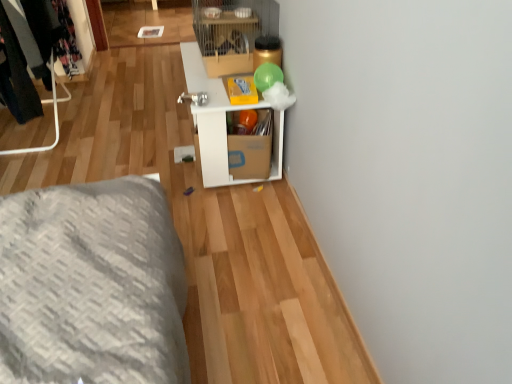
Question: From their relative heights in the image, would you say white cardboard shelf at center is taller or shorter than metal clothing rack at left?

Choices:
 (A) short
 (B) tall

Answer: (A)

Question: Is white cardboard shelf at center spatially inside metal clothing rack at left, or outside of it?

Choices:
 (A) outside
 (B) inside

Answer: (A)

Question: Considering the positions of white cardboard shelf at center and metal clothing rack at left in the image, is white cardboard shelf at center wider or thinner than metal clothing rack at left?

Choices:
 (A) thin
 (B) wide

Answer: (B)

Question: From the image's perspective, relative to white cardboard shelf at center, is metal clothing rack at left above or below?

Choices:
 (A) below
 (B) above

Answer: (B)

Question: From a real-world perspective, relative to white cardboard shelf at center, is metal clothing rack at left vertically above or below?

Choices:
 (A) below
 (B) above

Answer: (B)

Question: In the image, is metal clothing rack at left positioned in front of or behind white cardboard shelf at center?

Choices:
 (A) front
 (B) behind

Answer: (B)

Question: In terms of size, does metal clothing rack at left appear bigger or smaller than white cardboard shelf at center?

Choices:
 (A) big
 (B) small

Answer: (B)